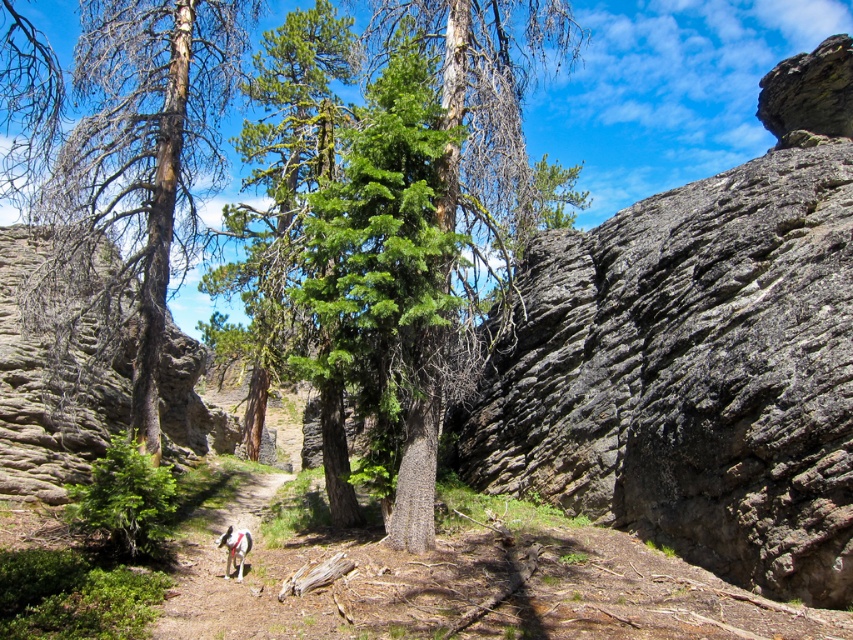
You are standing on the rocky path and see two white fur dogs. Which one is closer to you, the white fur dog at center or the white fur dog at lower center?

The white fur dog at center is closer to the viewer than the white fur dog at lower center.

You are a hiker who wants to take a photo of both the white fur dog at center and the white fur dog at lower center. Which dog should you focus on first to ensure both are in the frame?

Since the white fur dog at center is much taller than the white fur dog at lower center, you should focus on the white fur dog at center first to ensure both are in the frame.